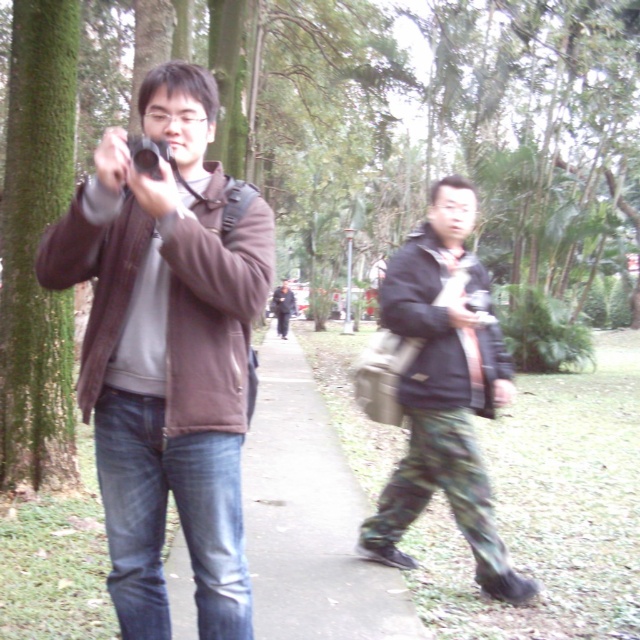
Consider the image. You are standing in the park and want to take a photo of the dark gray jacket at center. However, there is a concrete sidewalk at center blocking your view. Is the sidewalk to the left or right of the jacket?

The concrete sidewalk at center is to the right of the dark gray jacket at center, so the sidewalk is blocking the view to the right side of the jacket.

You are standing at the edge of the park and need to walk to the concrete sidewalk at center. There is a person wearing a brown matte jacket at center blocking your path. If you want to avoid walking around them, can you step over the gap between the person and the sidewalk?

The distance between the brown matte jacket at center and the concrete sidewalk at center is 3.49 meters. Since this gap is quite wide, stepping over it would not be feasible. You should consider walking around the person instead.

You are a photographer trying to capture a portrait of the person wearing the brown matte jacket at center. The camera you are using has a minimum focusing distance of 6 feet. Will you be able to take the photo without moving closer?

The brown matte jacket at center and camera are 5.99 feet apart, which is just under the 6 feet minimum focusing distance. Therefore, you will not be able to take the photo without moving closer.